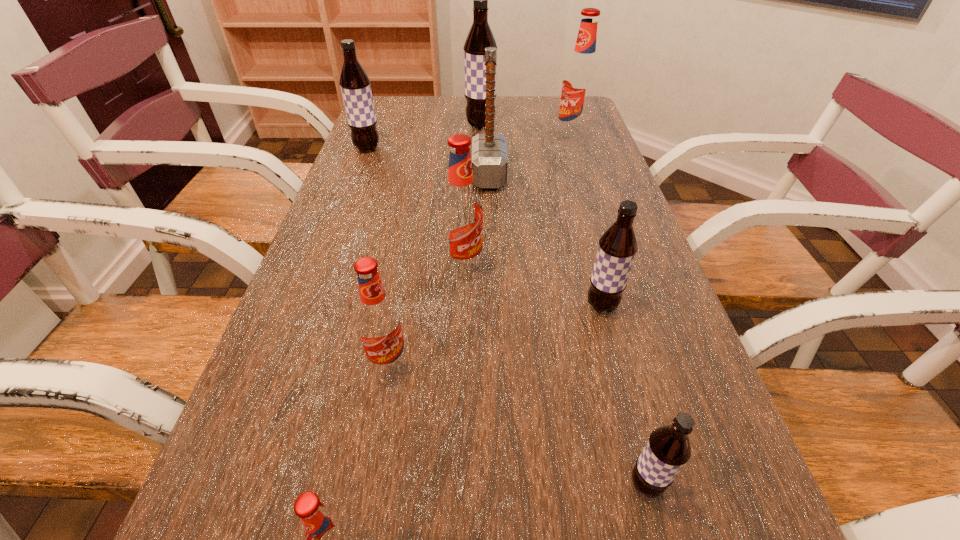
What are the coordinates of `the farthest root beer` in the screenshot? It's located at (480, 36).

I want to click on the farthest brown root beer, so click(480, 36).

Where is `the biggest red root beer`? the biggest red root beer is located at coordinates (579, 87).

Locate an element on the screen. the rightmost red root beer is located at coordinates (579, 87).

Where is `brown hammer`? brown hammer is located at coordinates (489, 151).

At what (x,y) coordinates should I click in order to perform the action: click on hammer. Please return your answer as a coordinate pair (x, y). The height and width of the screenshot is (540, 960). Looking at the image, I should click on (489, 151).

The height and width of the screenshot is (540, 960). I want to click on the second biggest brown root beer, so click(355, 85).

Identify the location of the leftmost object. (355, 85).

Find the location of `the third nearest red root beer`. the third nearest red root beer is located at coordinates (461, 208).

Locate an element on the screen. This screenshot has height=540, width=960. the fifth nearest root beer is located at coordinates (461, 208).